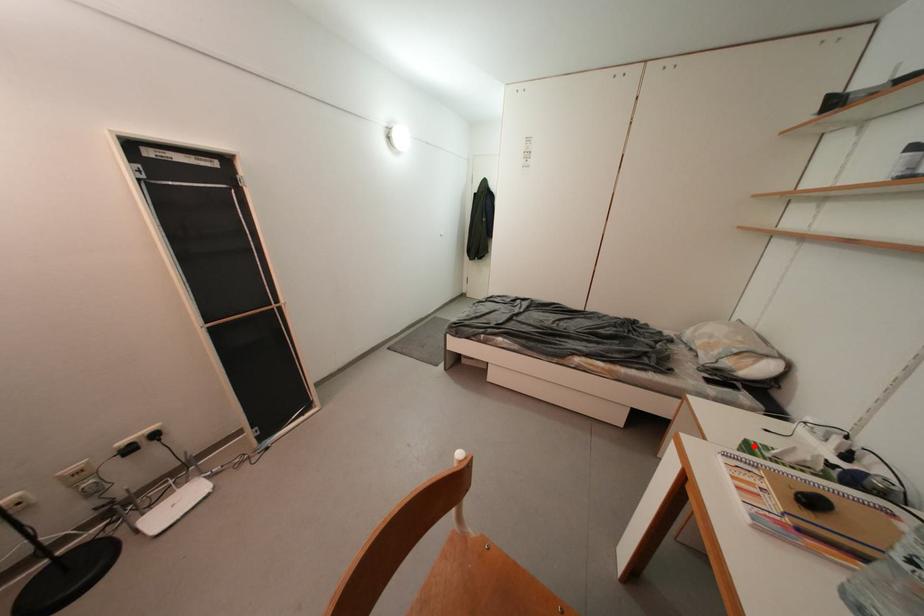
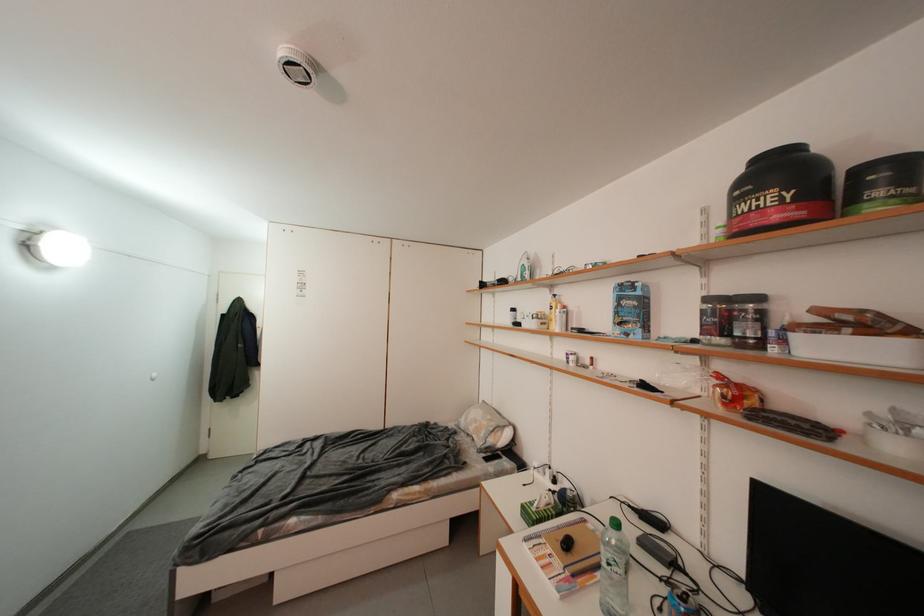
Question: I am providing you with two images of the same scene from different viewpoints. A red point is shown in image1. For the corresponding object point in image2, is it positioned nearer or farther from the camera?

Choices:
 (A) Nearer
 (B) Farther

Answer: (A)